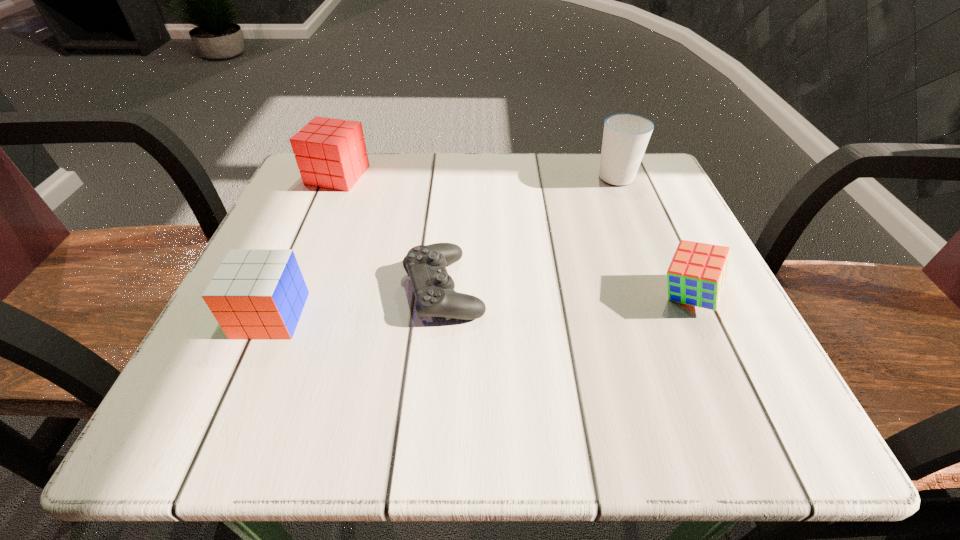
This screenshot has width=960, height=540. In order to click on free space between the cup and the rightmost cube in this screenshot , I will do `click(652, 235)`.

Locate an element on the screen. Image resolution: width=960 pixels, height=540 pixels. unoccupied area between the farthest cube and the cup is located at coordinates coord(476,175).

Where is `free spot between the cup and the third object from left to right`? free spot between the cup and the third object from left to right is located at coordinates (530, 232).

The width and height of the screenshot is (960, 540). Find the location of `free space between the shortest object and the farthest cube`. free space between the shortest object and the farthest cube is located at coordinates (391, 232).

Where is `vacant point located between the rightmost cube and the farthest cube`? Image resolution: width=960 pixels, height=540 pixels. vacant point located between the rightmost cube and the farthest cube is located at coordinates (513, 236).

This screenshot has width=960, height=540. I want to click on free spot between the farthest cube and the rightmost cube, so click(x=513, y=236).

Where is `empty location between the third object from right to left and the rightmost cube`? empty location between the third object from right to left and the rightmost cube is located at coordinates (566, 292).

Locate an element on the screen. Image resolution: width=960 pixels, height=540 pixels. object that ranks as the second closest to the rightmost cube is located at coordinates point(433,288).

Locate an element on the screen. The image size is (960, 540). object identified as the closest to the third object from left to right is located at coordinates (255, 294).

Where is `the second closest cube relative to the cup`? The height and width of the screenshot is (540, 960). the second closest cube relative to the cup is located at coordinates (331, 153).